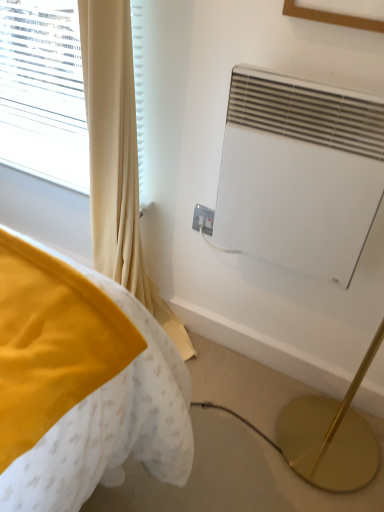
At what (x,y) coordinates should I click in order to perform the action: click on vacant space underneath white matte air conditioner at upper right (from a real-world perspective). Please return your answer as a coordinate pair (x, y). This screenshot has height=512, width=384. Looking at the image, I should click on (247, 365).